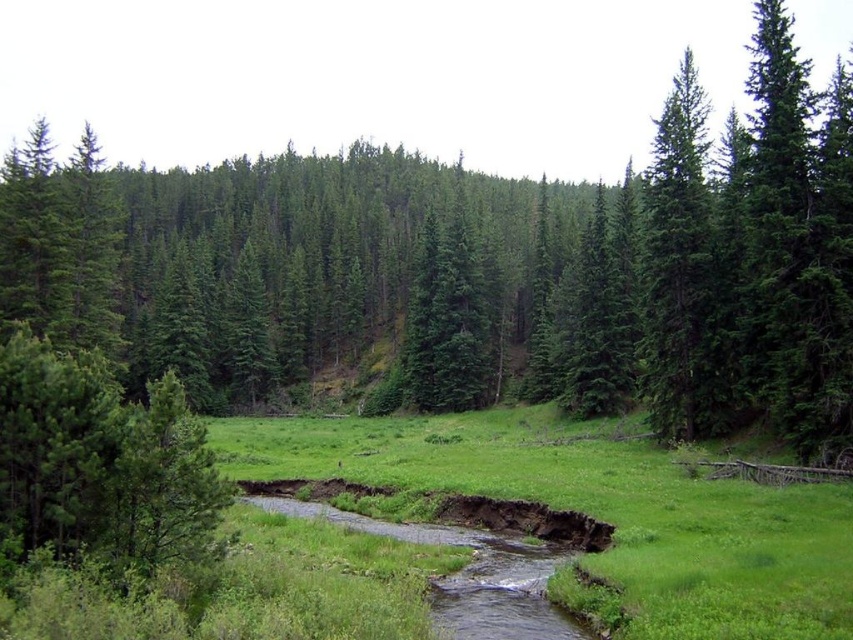
Question: Among these points, which one is nearest to the camera?

Choices:
 (A) (807, 582)
 (B) (454, 280)
 (C) (663, 259)

Answer: (A)

Question: Does green matte tree at center appear on the right side of green grassy field at center?

Choices:
 (A) no
 (B) yes

Answer: (B)

Question: Which object appears closest to the camera in this image?

Choices:
 (A) green matte tree at right
 (B) green matte tree at center

Answer: (B)

Question: Does green grassy field at center have a larger size compared to green matte tree at right?

Choices:
 (A) no
 (B) yes

Answer: (B)

Question: Can you confirm if green matte tree at center is positioned to the left of green grassy field at center?

Choices:
 (A) no
 (B) yes

Answer: (A)

Question: Which of the following is the farthest from the observer?

Choices:
 (A) green grassy field at center
 (B) green matte tree at center
 (C) green matte tree at right

Answer: (C)